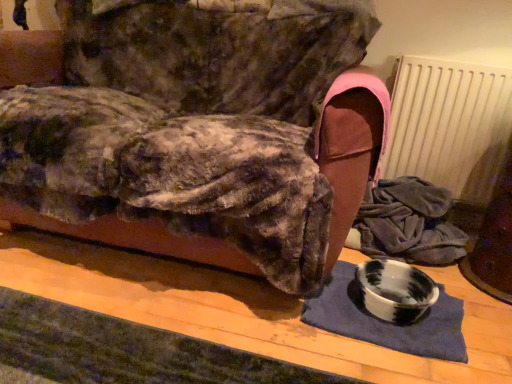
Question: Are marbled ceramic bowl at lower right and marble bowl at lower right far apart?

Choices:
 (A) no
 (B) yes

Answer: (A)

Question: Is marbled ceramic bowl at lower right positioned behind marble bowl at lower right?

Choices:
 (A) no
 (B) yes

Answer: (B)

Question: Is marble bowl at lower right at the back of marbled ceramic bowl at lower right?

Choices:
 (A) no
 (B) yes

Answer: (A)

Question: From the image's perspective, does marbled ceramic bowl at lower right appear lower than marble bowl at lower right?

Choices:
 (A) no
 (B) yes

Answer: (B)

Question: From the image's perspective, is marbled ceramic bowl at lower right on marble bowl at lower right?

Choices:
 (A) no
 (B) yes

Answer: (A)

Question: Is marbled ceramic bowl at lower right wider or thinner than marble bowl at lower right?

Choices:
 (A) thin
 (B) wide

Answer: (A)

Question: Considering the positions of marbled ceramic bowl at lower right and marble bowl at lower right in the image, is marbled ceramic bowl at lower right taller or shorter than marble bowl at lower right?

Choices:
 (A) short
 (B) tall

Answer: (A)

Question: Considering the relative positions of marbled ceramic bowl at lower right and marble bowl at lower right in the image provided, is marbled ceramic bowl at lower right to the left or to the right of marble bowl at lower right?

Choices:
 (A) left
 (B) right

Answer: (B)

Question: Would you say marbled ceramic bowl at lower right is inside or outside marble bowl at lower right?

Choices:
 (A) outside
 (B) inside

Answer: (A)

Question: Is point (198, 160) closer or farther from the camera than point (425, 276)?

Choices:
 (A) farther
 (B) closer

Answer: (B)

Question: Would you say marble bowl at lower right is inside or outside marbled ceramic bowl at lower right?

Choices:
 (A) outside
 (B) inside

Answer: (A)

Question: From a real-world perspective, is marble bowl at lower right positioned above or below marbled ceramic bowl at lower right?

Choices:
 (A) below
 (B) above

Answer: (B)

Question: From the image's perspective, is marble bowl at lower right above or below marbled ceramic bowl at lower right?

Choices:
 (A) below
 (B) above

Answer: (B)

Question: From the image's perspective, is marbled ceramic bowl at lower right above or below white matte radiator at upper right?

Choices:
 (A) above
 (B) below

Answer: (B)

Question: Relative to white matte radiator at upper right, is marbled ceramic bowl at lower right in front or behind?

Choices:
 (A) behind
 (B) front

Answer: (B)